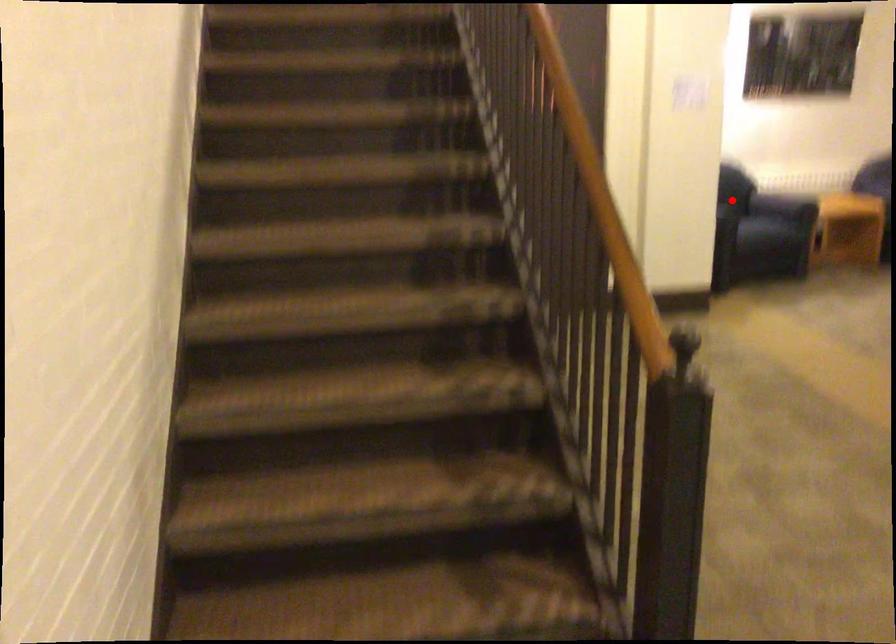
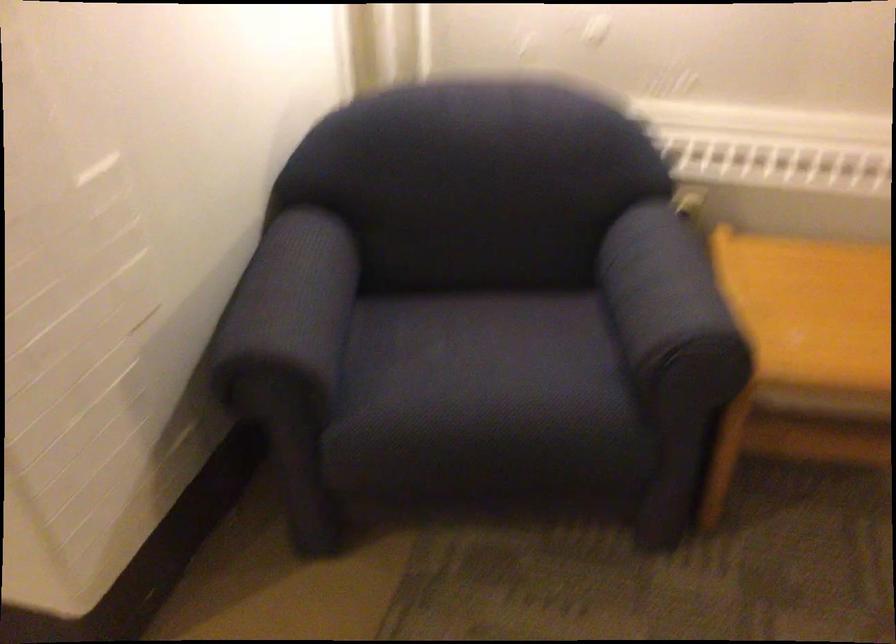
Question: I am providing you with two images of the same scene from different viewpoints. A red point is shown in image1. For the corresponding object point in image2, is it positioned nearer or farther from the camera?

Choices:
 (A) Nearer
 (B) Farther

Answer: (A)